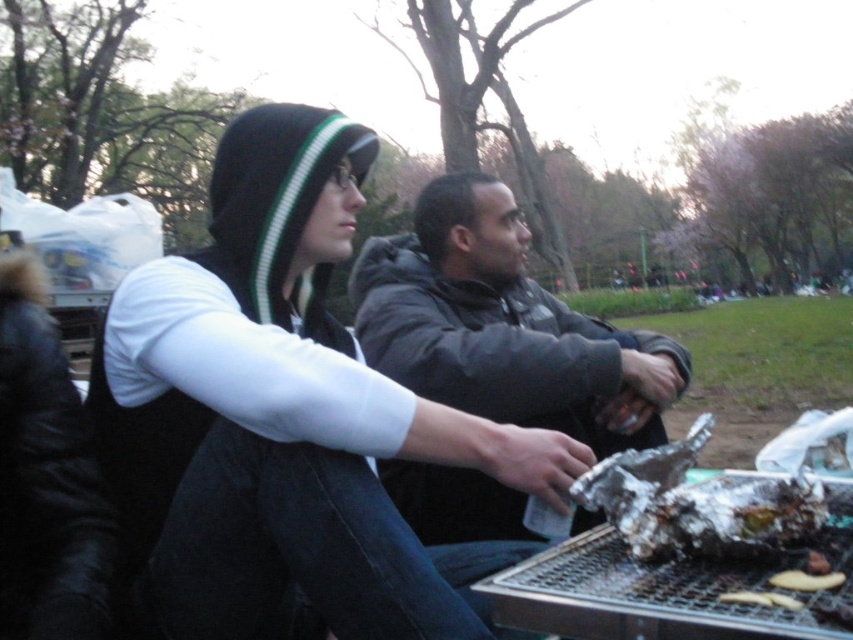
You are a food delivery robot that needs to place a new order of golden brown crispy bread at lower right onto the picnic table without disturbing the black fleece hoodie at upper left. Can you fit it in the space between them?

The black fleece hoodie at upper left is 23.09 inches away from the golden brown crispy bread at lower right, so yes, there is enough space to place the golden brown crispy bread at lower right without disturbing the hoodie.

You are a photographer standing at the center of the park. You want to take a photo of the black fleece hoodie at upper left. Which direction should you move to get the hoodie within your camera frame?

The black fleece hoodie at upper left is located at point 0.656 on the x axis and 0.335 on the y axis. Since you are at the center, you should move towards the upper left direction to get the hoodie within your camera frame.